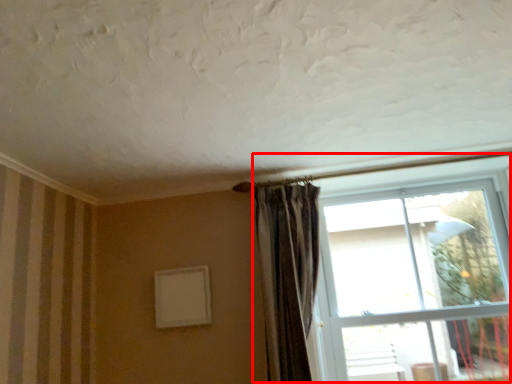
Question: From the image's perspective, what is the correct spatial relationship of window (annotated by the red box) in relation to curtain?

Choices:
 (A) below
 (B) above

Answer: (A)